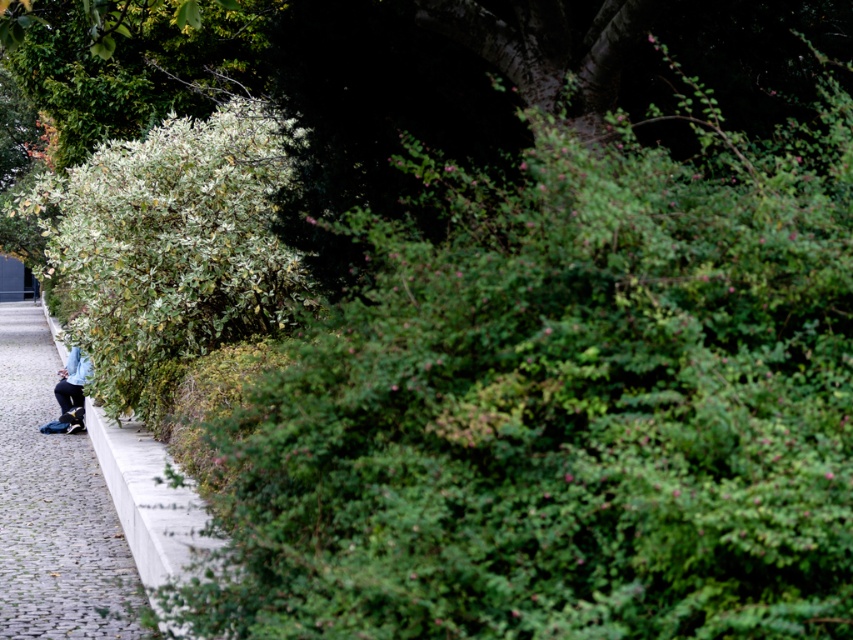
Question: Does gray concrete pavement at lower left have a lesser width compared to light blue fabric at lower left?

Choices:
 (A) no
 (B) yes

Answer: (A)

Question: Which point is farther to the camera?

Choices:
 (A) green matte bush at left
 (B) gray concrete pavement at lower left

Answer: (A)

Question: Is green matte bush at left further to the viewer compared to light blue fabric at lower left?

Choices:
 (A) no
 (B) yes

Answer: (A)

Question: Is green matte bush at left below gray concrete pavement at lower left?

Choices:
 (A) no
 (B) yes

Answer: (A)

Question: Which of the following is the closest to the observer?

Choices:
 (A) green matte bush at left
 (B) light blue fabric at lower left
 (C) gray concrete pavement at lower left

Answer: (C)

Question: Which of the following is the farthest from the observer?

Choices:
 (A) light blue fabric at lower left
 (B) gray concrete pavement at lower left

Answer: (A)